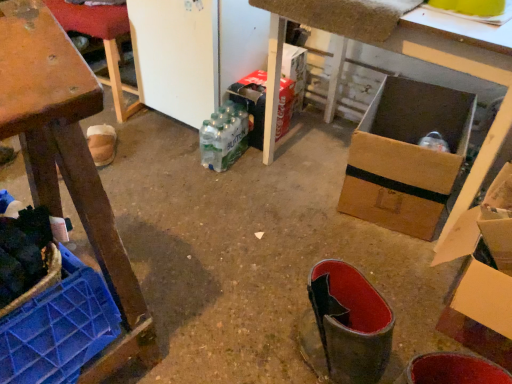
Question: From the image's perspective, does cardboard box at right, the 2th cardboard box from the back, appear higher than cardboard box at center?

Choices:
 (A) no
 (B) yes

Answer: (A)

Question: Considering the relative sizes of cardboard box at right, arranged as the 1th cardboard box when viewed from the front, and cardboard box at center in the image provided, is cardboard box at right, arranged as the 1th cardboard box when viewed from the front, wider than cardboard box at center?

Choices:
 (A) no
 (B) yes

Answer: (A)

Question: Is cardboard box at right, the 2th cardboard box from the back, bigger than cardboard box at center?

Choices:
 (A) yes
 (B) no

Answer: (B)

Question: From a real-world perspective, is cardboard box at right, arranged as the 1th cardboard box when viewed from the front, positioned over cardboard box at center based on gravity?

Choices:
 (A) no
 (B) yes

Answer: (B)

Question: Considering the relative positions of cardboard box at right, the 2th cardboard box from the back, and cardboard box at center in the image provided, is cardboard box at right, the 2th cardboard box from the back, to the right of cardboard box at center from the viewer's perspective?

Choices:
 (A) no
 (B) yes

Answer: (B)

Question: From a real-world perspective, is cardboard box at right, arranged as the 1th cardboard box when viewed from the front, physically below cardboard box at center?

Choices:
 (A) no
 (B) yes

Answer: (A)

Question: From a real-world perspective, is cardboard box at right, which is counted as the 2th cardboard box, starting from the left, physically below wooden crate at left, acting as the 1th furniture starting from the front?

Choices:
 (A) yes
 (B) no

Answer: (B)

Question: Is cardboard box at right, positioned as the 1th cardboard box in right-to-left order, at the right side of wooden crate at left, acting as the 1th furniture starting from the front?

Choices:
 (A) no
 (B) yes

Answer: (B)

Question: Is cardboard box at right, the 2th cardboard box from the back, turned away from wooden crate at left, acting as the 1th furniture starting from the front?

Choices:
 (A) yes
 (B) no

Answer: (B)

Question: Is wooden crate at left, the first furniture from the bottom, located within cardboard box at right, arranged as the 1th cardboard box when viewed from the front?

Choices:
 (A) no
 (B) yes

Answer: (A)

Question: From a real-world perspective, is cardboard box at right, which is counted as the 2th cardboard box, starting from the left, physically above wooden crate at left, the first furniture from the bottom?

Choices:
 (A) no
 (B) yes

Answer: (B)

Question: Is the position of cardboard box at right, positioned as the 1th cardboard box in right-to-left order, more distant than that of wooden crate at left, which is the 2th furniture in top-to-bottom order?

Choices:
 (A) no
 (B) yes

Answer: (B)

Question: Does brown cardboard box at center appear on the left side of cardboard box at right, positioned as the 1th cardboard box in right-to-left order?

Choices:
 (A) yes
 (B) no

Answer: (A)